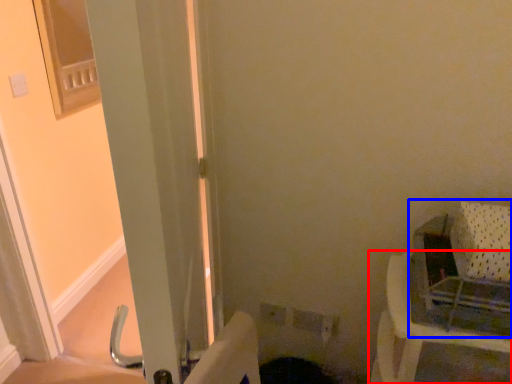
Question: Which object is closer to the camera taking this photo, furniture (highlighted by a red box) or baby carriage (highlighted by a blue box)?

Choices:
 (A) furniture
 (B) baby carriage

Answer: (B)